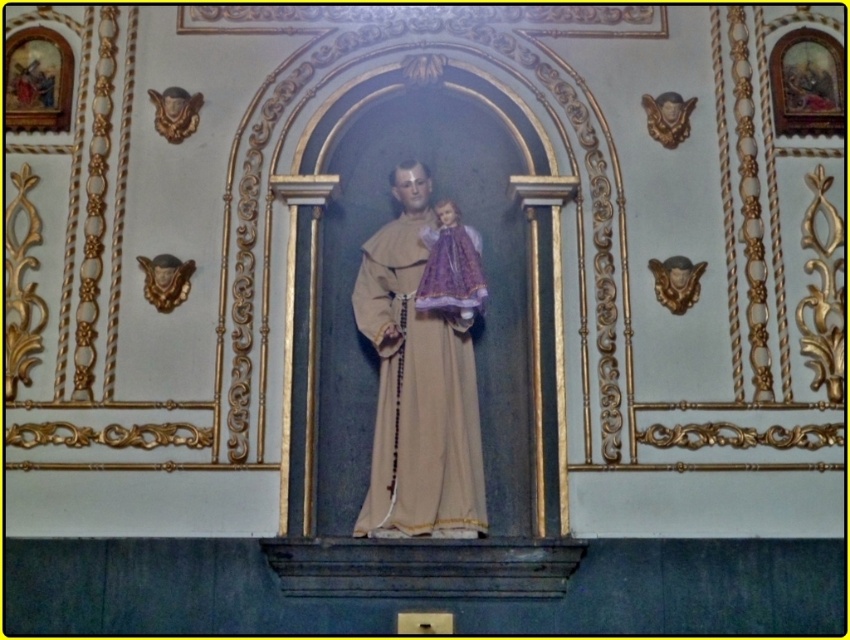
Question: Is matte gold statue at center above purple satin doll at center?

Choices:
 (A) yes
 (B) no

Answer: (B)

Question: Can you confirm if matte gold statue at center is positioned to the right of purple satin doll at center?

Choices:
 (A) no
 (B) yes

Answer: (A)

Question: Which point appears farthest from the camera in this image?

Choices:
 (A) (383, 416)
 (B) (434, 256)

Answer: (B)

Question: Which of the following is the closest to the observer?

Choices:
 (A) (425, 288)
 (B) (479, 428)

Answer: (B)

Question: Does matte gold statue at center appear over purple satin doll at center?

Choices:
 (A) yes
 (B) no

Answer: (B)